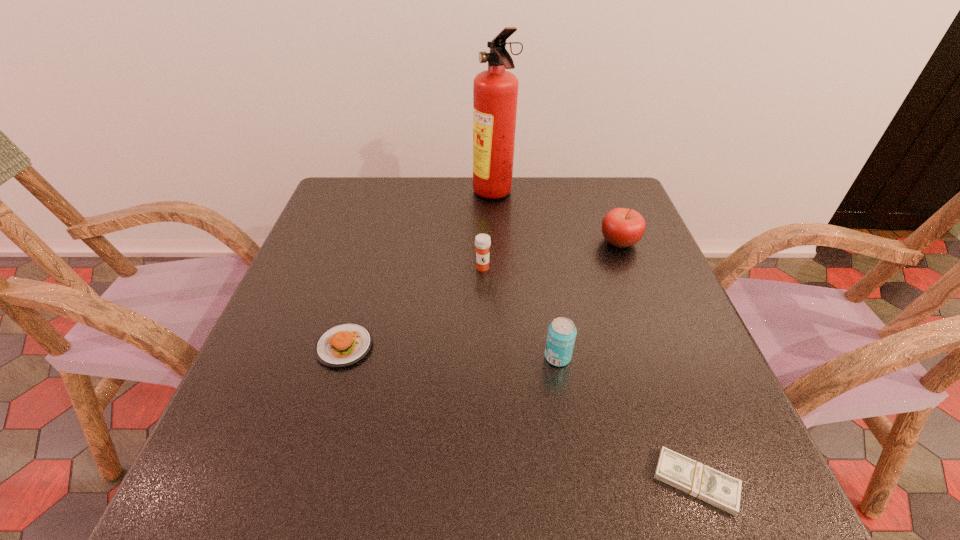
What are the coordinates of `object that is the fourth closest one to the fourth nearest object` in the screenshot? It's located at (621, 227).

This screenshot has height=540, width=960. Identify the location of free region that satisfies the following two spatial constraints: 1. on the front-facing side of the farthest object; 2. on the left side of the nearest object. (507, 482).

This screenshot has width=960, height=540. In order to click on free location that satisfies the following two spatial constraints: 1. on the label side of the medicine; 2. on the left side of the beer can in this screenshot , I will do `click(483, 357)`.

Image resolution: width=960 pixels, height=540 pixels. I want to click on vacant area that satisfies the following two spatial constraints: 1. on the front-facing side of the tallest object; 2. on the left side of the fourth object from left to right, so click(501, 357).

Where is `vacant region that satisfies the following two spatial constraints: 1. on the front side of the nearest object; 2. on the right side of the fourth object from left to right`? vacant region that satisfies the following two spatial constraints: 1. on the front side of the nearest object; 2. on the right side of the fourth object from left to right is located at coordinates (578, 482).

You are a GUI agent. You are given a task and a screenshot of the screen. Output one action in this format:
    pyautogui.click(x=<x>, y=<y>)
    Task: Click on the vacant space that satisfies the following two spatial constraints: 1. on the front-facing side of the tallest object; 2. on the back side of the second farthest object
    Image resolution: width=960 pixels, height=540 pixels.
    Given the screenshot: What is the action you would take?
    pyautogui.click(x=496, y=241)